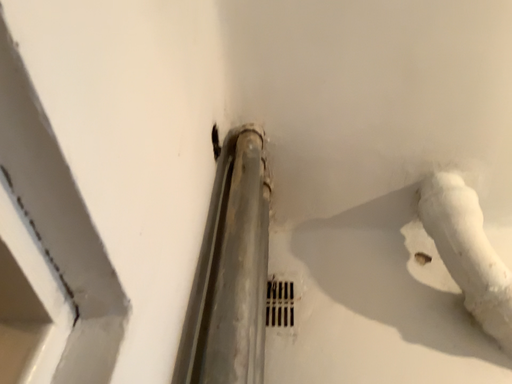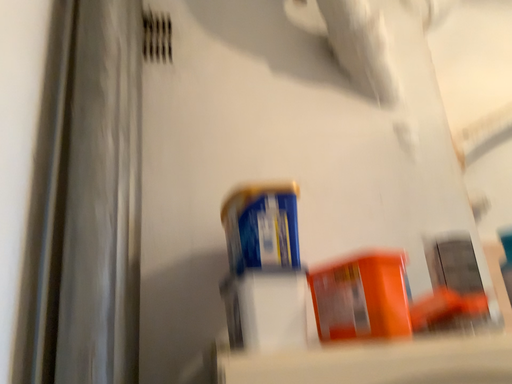
Question: Which way did the camera rotate in the video?

Choices:
 (A) rotated upward
 (B) rotated downward

Answer: (B)